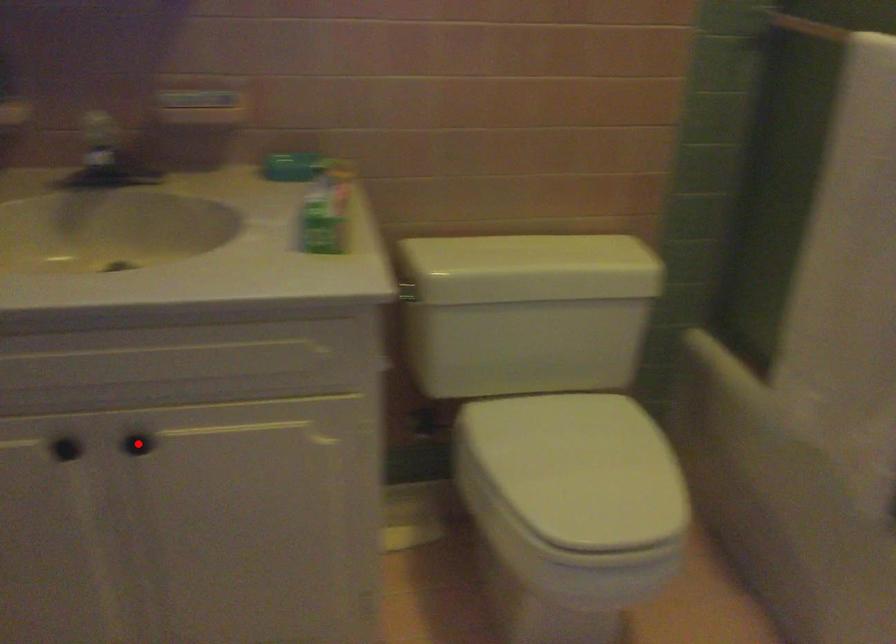
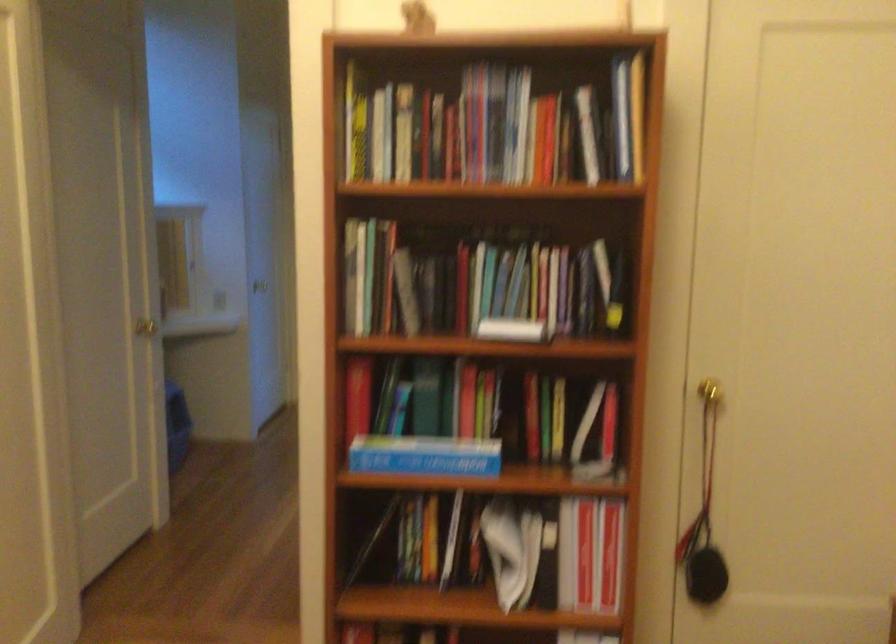
Question: I am providing you with two images of the same scene from different viewpoints. A red point is marked on the first image. Can you still see the location of the red point in image 2?

Choices:
 (A) Yes
 (B) No

Answer: (B)